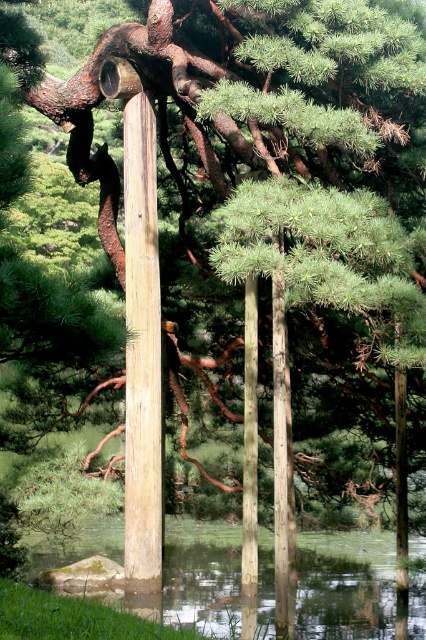
Which of these two, clear water at center or smooth gray pole at center, stands shorter?

With less height is clear water at center.

Can you confirm if clear water at center is positioned to the left of smooth gray pole at center?

Indeed, clear water at center is positioned on the left side of smooth gray pole at center.

The image size is (426, 640). What do you see at coordinates (345, 586) in the screenshot?
I see `clear water at center` at bounding box center [345, 586].

The image size is (426, 640). In order to click on clear water at center in this screenshot , I will do `click(345, 586)`.

Which is more to the left, light brown wood post at center or smooth gray pole at center?

light brown wood post at center

Consider the image. Does light brown wood post at center appear on the left side of smooth gray pole at center?

Correct, you'll find light brown wood post at center to the left of smooth gray pole at center.

Find the location of a particular element. light brown wood post at center is located at coordinates (141, 352).

Who is positioned more to the right, smooth wood pole at center or smooth gray pole at center?

From the viewer's perspective, smooth wood pole at center appears more on the right side.

Is smooth wood pole at center smaller than smooth gray pole at center?

Yes, smooth wood pole at center is smaller than smooth gray pole at center.

Image resolution: width=426 pixels, height=640 pixels. What do you see at coordinates (282, 468) in the screenshot?
I see `smooth wood pole at center` at bounding box center [282, 468].

I want to click on smooth wood pole at center, so click(282, 468).